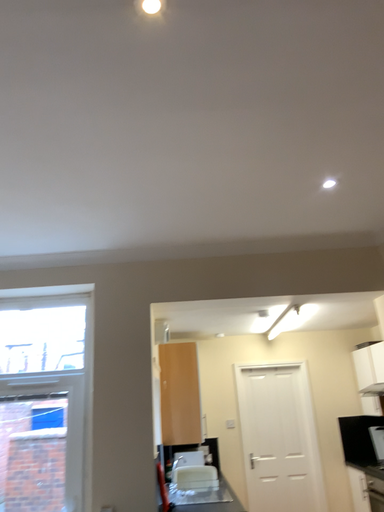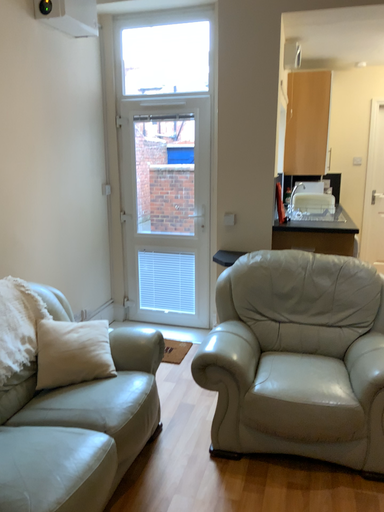
Question: Which way did the camera rotate in the video?

Choices:
 (A) rotated left
 (B) rotated right

Answer: (A)